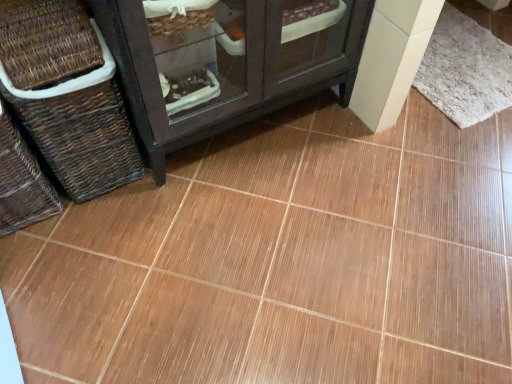
What is the approximate height of brown woven basket at left, the first basket from the right?

brown woven basket at left, the first basket from the right, is 20.82 inches in height.

The width and height of the screenshot is (512, 384). In order to click on white fluffy mat at upper right in this screenshot , I will do `click(465, 70)`.

Considering the sizes of brown woven basket at left, the first basket in the left-to-right sequence, and white fluffy mat at upper right in the image, is brown woven basket at left, the first basket in the left-to-right sequence, bigger or smaller than white fluffy mat at upper right?

Clearly, brown woven basket at left, the first basket in the left-to-right sequence, is larger in size than white fluffy mat at upper right.

From a real-world perspective, which is physically above, brown woven basket at left, the first basket in the left-to-right sequence, or white fluffy mat at upper right?

brown woven basket at left, the first basket in the left-to-right sequence, is physically above.

Between point (18, 132) and point (462, 75), which one is positioned in front?

The point (18, 132) is closer.

Is brown woven basket at left, the second basket from the right, placed right next to brown woven basket at left, the first basket from the right?

No, brown woven basket at left, the second basket from the right, is not with brown woven basket at left, the first basket from the right.

From the image's perspective, which object appears higher, brown woven basket at left, the first basket in the left-to-right sequence, or brown woven basket at left, the first basket from the right?

From the image's view, brown woven basket at left, the first basket from the right, is above.

Is brown woven basket at left, the first basket in the left-to-right sequence, outside of brown woven basket at left, acting as the 2th basket starting from the left?

Yes, brown woven basket at left, the first basket in the left-to-right sequence, is outside of brown woven basket at left, acting as the 2th basket starting from the left.

Are brown woven basket at left, acting as the 2th basket starting from the left, and brown woven basket at left, the second basket from the right, far apart?

No, there isn't a large distance between brown woven basket at left, acting as the 2th basket starting from the left, and brown woven basket at left, the second basket from the right.

Is brown woven basket at left, the first basket from the right, positioned before brown woven basket at left, the first basket in the left-to-right sequence?

That is False.

Is brown woven basket at left, the first basket from the right, completely or partially outside of brown woven basket at left, the second basket from the right?

brown woven basket at left, the first basket from the right, lies outside brown woven basket at left, the second basket from the right,'s area.

Is point (81, 107) positioned in front of point (17, 188)?

Yes, point (81, 107) is closer to viewer.

Considering the relative positions of brown woven basket at left, the first basket from the right, and white fluffy mat at upper right in the image provided, is brown woven basket at left, the first basket from the right, in front of white fluffy mat at upper right?

Yes, it is in front of white fluffy mat at upper right.

From a real-world perspective, starting from the white fluffy mat at upper right, which basket is the 2nd one vertically above it? Please provide its 2D coordinates.

[(67, 95)]

Does brown woven basket at left, the first basket from the right, have a larger size compared to white fluffy mat at upper right?

Yes, brown woven basket at left, the first basket from the right, is bigger than white fluffy mat at upper right.

Considering the positions of objects white fluffy mat at upper right and brown woven basket at left, the first basket from the right, in the image provided, who is in front, white fluffy mat at upper right or brown woven basket at left, the first basket from the right,?

brown woven basket at left, the first basket from the right, is more forward.

Based on the photo, how different are the orientations of white fluffy mat at upper right and brown woven basket at left, acting as the 2th basket starting from the left, in degrees?

The angular difference between white fluffy mat at upper right and brown woven basket at left, acting as the 2th basket starting from the left, is 0.377 degrees.

Which of these two, white fluffy mat at upper right or brown woven basket at left, acting as the 2th basket starting from the left, stands shorter?

white fluffy mat at upper right.

Does point (465, 106) come closer to viewer compared to point (105, 122)?

That is False.

Could you measure the distance between white fluffy mat at upper right and brown woven basket at left, the first basket in the left-to-right sequence?

white fluffy mat at upper right and brown woven basket at left, the first basket in the left-to-right sequence, are 5.26 feet apart.

This screenshot has width=512, height=384. What are the coordinates of `mat directly beneath the brown woven basket at left, the first basket in the left-to-right sequence (from a real-world perspective)` in the screenshot? It's located at (465, 70).

Between white fluffy mat at upper right and brown woven basket at left, the second basket from the right, which one has larger width?

white fluffy mat at upper right is wider.

Relative to brown woven basket at left, the first basket in the left-to-right sequence, is white fluffy mat at upper right in front or behind?

white fluffy mat at upper right is behind brown woven basket at left, the first basket in the left-to-right sequence.

Image resolution: width=512 pixels, height=384 pixels. I want to click on the 2nd basket below the white fluffy mat at upper right (from the image's perspective), so click(x=22, y=182).

This screenshot has height=384, width=512. In order to click on basket that is on the right side of brown woven basket at left, the first basket in the left-to-right sequence in this screenshot , I will do `click(67, 95)`.

When comparing their distances from brown woven basket at left, the first basket from the right, does brown woven basket at left, the second basket from the right, or white fluffy mat at upper right seem further?

Based on the image, white fluffy mat at upper right appears to be further to brown woven basket at left, the first basket from the right.

Looking at the image, which one is located closer to brown woven basket at left, the first basket in the left-to-right sequence, white fluffy mat at upper right or brown woven basket at left, acting as the 2th basket starting from the left?

Based on the image, brown woven basket at left, acting as the 2th basket starting from the left, appears to be nearer to brown woven basket at left, the first basket in the left-to-right sequence.

When comparing their distances from white fluffy mat at upper right, does brown woven basket at left, the second basket from the right, or brown woven basket at left, the first basket from the right, seem further?

brown woven basket at left, the second basket from the right, is further to white fluffy mat at upper right.

From the picture: From the image, which object appears to be farther from brown woven basket at left, acting as the 2th basket starting from the left, white fluffy mat at upper right or brown woven basket at left, the second basket from the right?

white fluffy mat at upper right is positioned further to the anchor brown woven basket at left, acting as the 2th basket starting from the left.

From the image, which object appears to be nearer to white fluffy mat at upper right, brown woven basket at left, the first basket from the right, or brown woven basket at left, the first basket in the left-to-right sequence?

Based on the image, brown woven basket at left, the first basket from the right, appears to be nearer to white fluffy mat at upper right.

When comparing their distances from brown woven basket at left, the second basket from the right, does brown woven basket at left, the first basket from the right, or white fluffy mat at upper right seem closer?

brown woven basket at left, the first basket from the right, is positioned closer to the anchor brown woven basket at left, the second basket from the right.

Locate an element on the screen. basket between brown woven basket at left, the first basket in the left-to-right sequence, and white fluffy mat at upper right, in the horizontal direction is located at coordinates (67, 95).